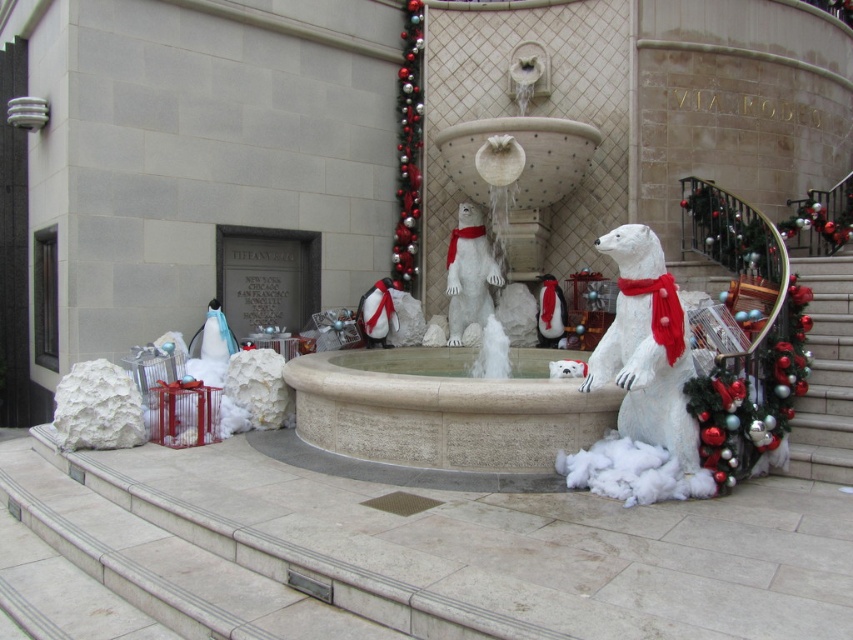
You are a visitor approaching the festive outdoor scene. You want to reach the shiny metallic garland at center to take a closer look. Which direction should you move from the smooth stone staircase at lower right to get there?

The smooth stone staircase at lower right is located below the shiny metallic garland at center, so you should move upward towards the shiny metallic garland at center from the smooth stone staircase at lower right.

You are a visitor at the fountain and want to take a photo of the white paper bear at center without the smooth stone staircase at lower right appearing in the background. Is this possible?

The white paper bear at center is in front of the smooth stone staircase at lower right, so if you position yourself so that the bear is between you and the staircase, the staircase should not appear in the background of the photo.

You are a delivery person carrying a large package and need to place it somewhere in the scene. The package is too heavy to lift, so you must choose between the smooth stone staircase at lower right and the shiny metallic garland at center. Which location can accommodate the package based on their sizes?

The smooth stone staircase at lower right is larger in size than the shiny metallic garland at center, so the package should be placed on the smooth stone staircase at lower right as it can accommodate the larger size.